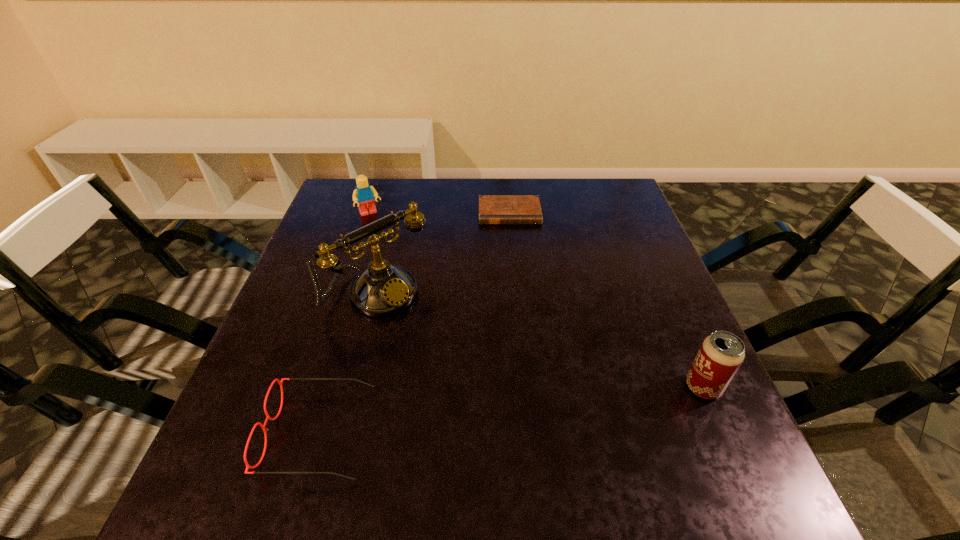
The height and width of the screenshot is (540, 960). In order to click on vacant space on the desktop that is between the fourth tallest object and the rightmost object and is positioned on the dial of the telephone in this screenshot , I will do `click(506, 410)`.

Find the location of a particular element. vacant space on the desktop that is between the spectacles and the beer can and is positioned on the spine side of the shortest object is located at coordinates (526, 408).

Locate an element on the screen. free space on the desktop that is between the fourth tallest object and the rightmost object and is positioned on the front-facing side of the Lego is located at coordinates (482, 414).